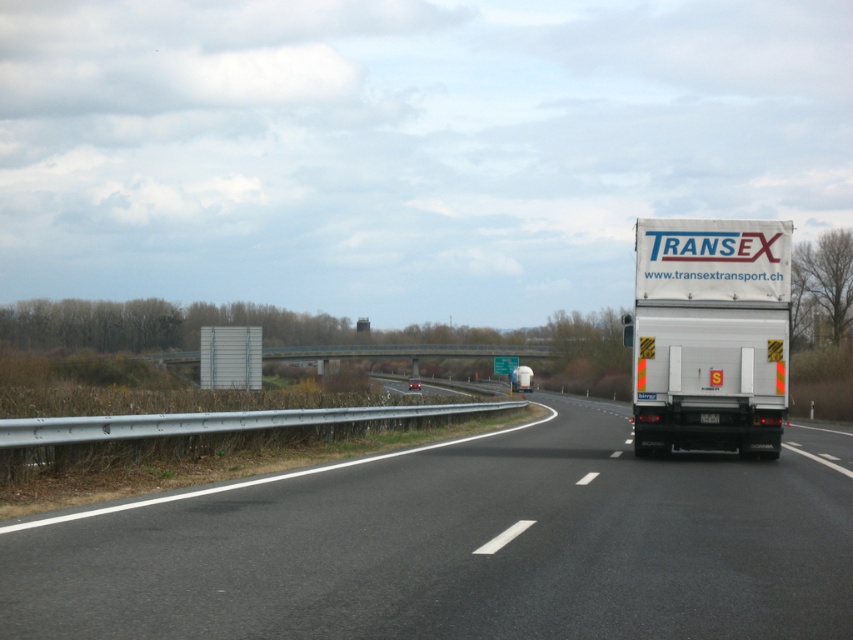
Question: Can you confirm if black asphalt highway at center is wider than white matte trailer truck at right?

Choices:
 (A) yes
 (B) no

Answer: (A)

Question: Which point is closer to the camera?

Choices:
 (A) (294, 525)
 (B) (651, 330)

Answer: (A)

Question: Among these objects, which one is farthest from the camera?

Choices:
 (A) white matte trailer truck at right
 (B) black asphalt highway at center

Answer: (A)

Question: Which point is farther to the camera?

Choices:
 (A) white matte trailer truck at right
 (B) black asphalt highway at center

Answer: (A)

Question: Is black asphalt highway at center thinner than white matte trailer truck at right?

Choices:
 (A) yes
 (B) no

Answer: (B)

Question: Does black asphalt highway at center have a larger size compared to white matte trailer truck at right?

Choices:
 (A) no
 (B) yes

Answer: (B)